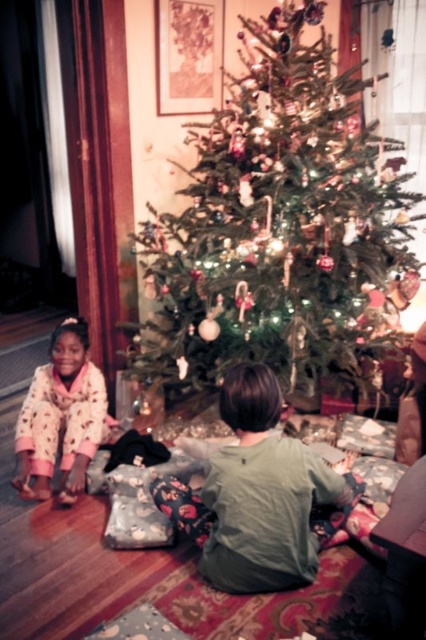
Is green cotton shirt at center taller than pink fleece pajamas at lower left?

Incorrect, green cotton shirt at center's height is not larger of pink fleece pajamas at lower left's.

Which is more to the right, green cotton shirt at center or pink fleece pajamas at lower left?

Positioned to the right is green cotton shirt at center.

This screenshot has height=640, width=426. What are the coordinates of `green cotton shirt at center` in the screenshot? It's located at (261, 492).

Looking at this image, who is more distant from viewer, [359,118] or [86,346]?

The point [359,118] is more distant.

You are a GUI agent. You are given a task and a screenshot of the screen. Output one action in this format:
    pyautogui.click(x=<x>, y=<y>)
    Task: Click on the green textured christmas tree at center
    This screenshot has height=640, width=426.
    Given the screenshot: What is the action you would take?
    pyautogui.click(x=276, y=221)

Between point (250, 19) and point (20, 428), which one is positioned in front?

Positioned in front is point (20, 428).

Identify the location of green textured christmas tree at center. (276, 221).

Does green textured christmas tree at center have a lesser height compared to green cotton shirt at center?

No, green textured christmas tree at center is not shorter than green cotton shirt at center.

Is point (301, 291) in front of point (264, 396)?

No, it is behind (264, 396).

Where is `green textured christmas tree at center`? This screenshot has height=640, width=426. green textured christmas tree at center is located at coordinates (276, 221).